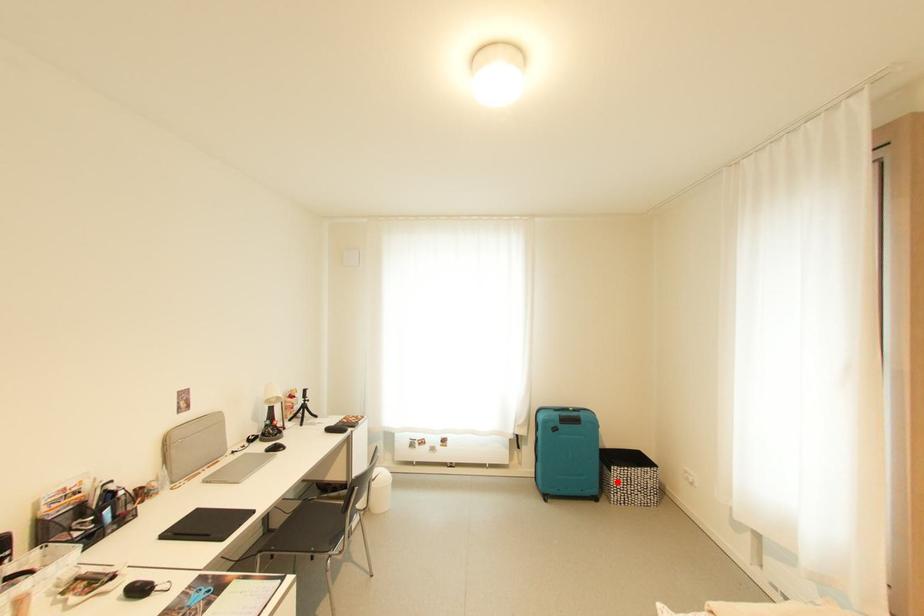
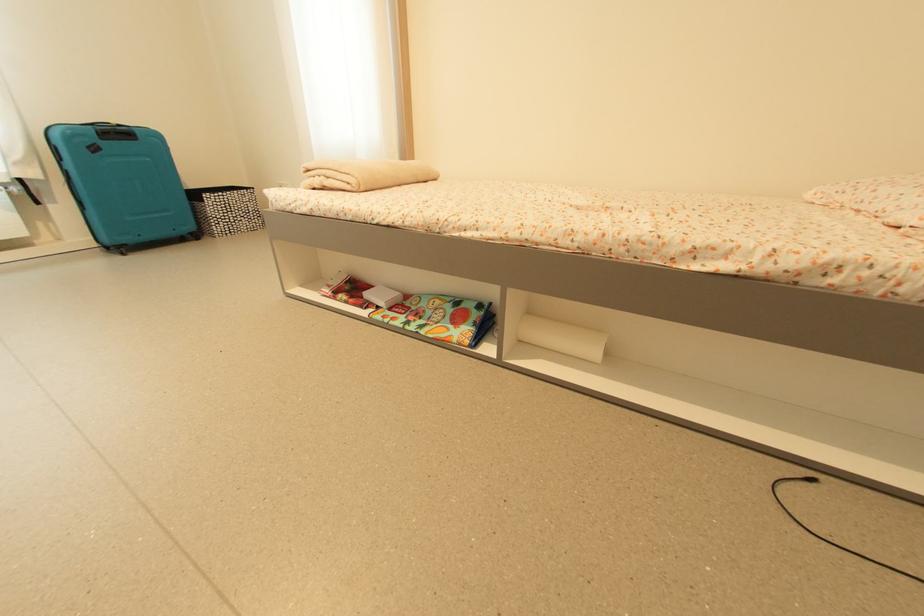
In the second image, find the point that corresponds to the highlighted location in the first image.

(213, 212)